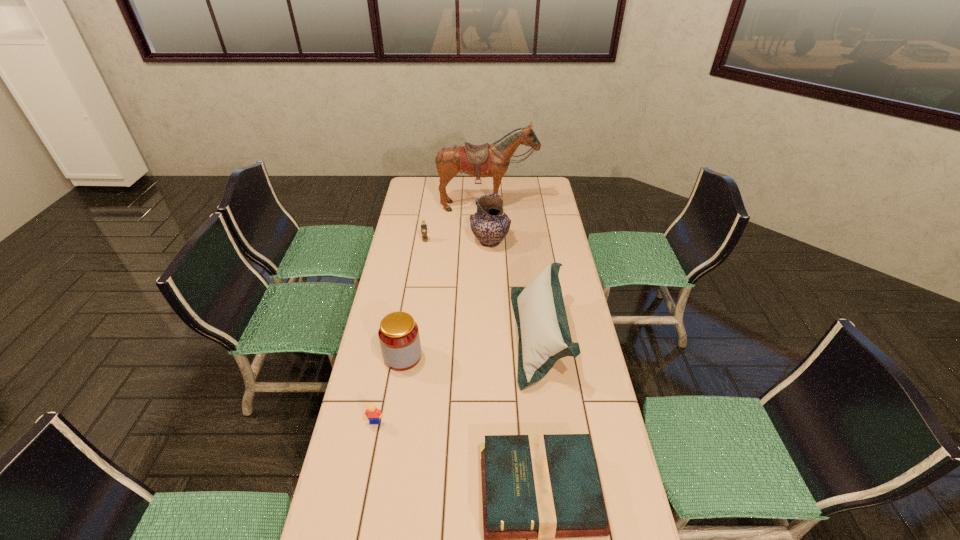
Identify the location of vacant space located on the surface of the cushion. This screenshot has width=960, height=540. (417, 336).

The width and height of the screenshot is (960, 540). In order to click on vacant point located 0.270m on the surface of the cushion in this screenshot , I will do `click(441, 336)`.

Find the location of `free space located 0.060m on the right of the jar`. free space located 0.060m on the right of the jar is located at coordinates (439, 356).

Find the location of a particular element. The height and width of the screenshot is (540, 960). free spot located 0.120m on the front label of the fifth tallest object is located at coordinates (422, 259).

Find the location of a particular element. The height and width of the screenshot is (540, 960). free space located on the face of the Lego is located at coordinates (365, 476).

What are the coordinates of `jar located at the left edge` in the screenshot? It's located at (399, 338).

The image size is (960, 540). I want to click on soda at the left edge, so click(x=423, y=225).

Identify the location of Lego present at the left edge. The height and width of the screenshot is (540, 960). (373, 414).

Identify the location of saddle at the right edge. (480, 161).

What are the coordinates of `cushion present at the right edge` in the screenshot? It's located at (544, 337).